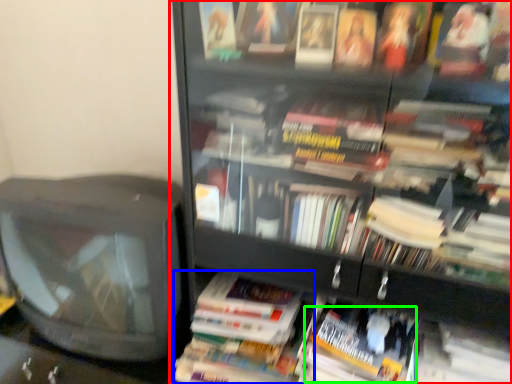
Question: Based on their relative distances, which object is farther from bookcase (highlighted by a red box)? Choose from paperback book (highlighted by a blue box) and paperback book (highlighted by a green box).

Choices:
 (A) paperback book
 (B) paperback book

Answer: (A)